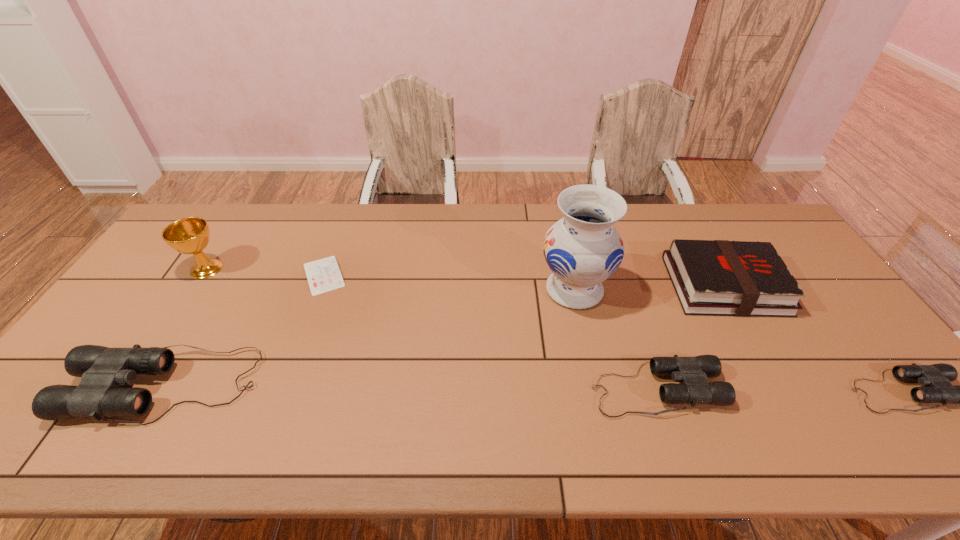
Identify which binoculars is the nearest to the diary. Please provide its 2D coordinates. Your answer should be formatted as a tuple, i.e. [(x, y)], where the tuple contains the x and y coordinates of a point satisfying the conditions above.

[(103, 370)]

The width and height of the screenshot is (960, 540). In order to click on binoculars that stands as the third closest to the second tallest object in this screenshot , I will do `click(936, 377)`.

The image size is (960, 540). What are the coordinates of `vacant space that satisfies the following two spatial constraints: 1. on the front side of the hardback book; 2. at the eyepiece of the fifth tallest object` in the screenshot? It's located at (783, 390).